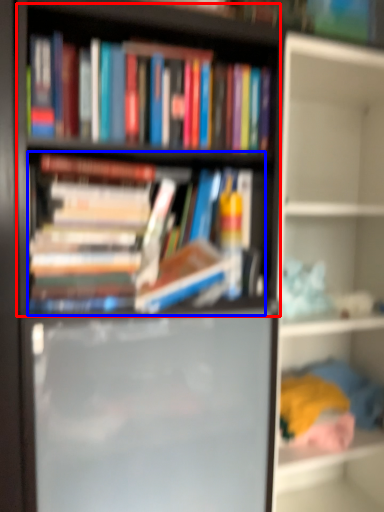
Question: Which object appears farthest to the camera in this image, bookshelf (highlighted by a red box) or book (highlighted by a blue box)?

Choices:
 (A) bookshelf
 (B) book

Answer: (B)